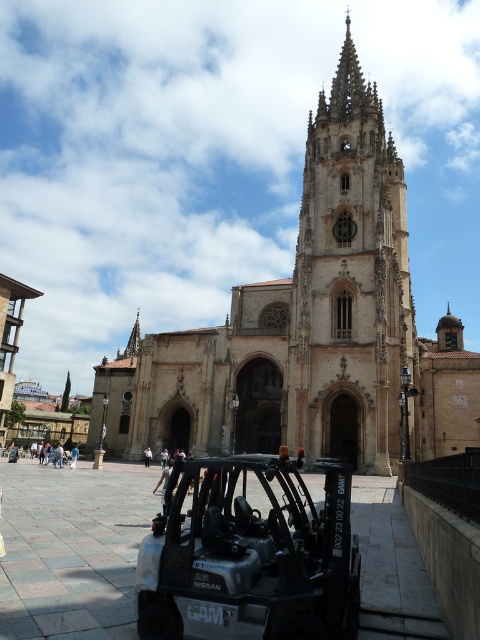
You are standing at the entrance of the beige stone church at center. If you look towards the direction of the forklift parked on the paved area in the foreground, which direction should you face?

The beige stone church at center is located at point (308, 328), which is the center of the image. The forklift is in the foreground, so it is closer to the viewer. To face the direction of the forklift parked on the paved area in the foreground from the entrance of the beige stone church at center, you should face towards the foreground, which is typically the front part of the image. However, without specific spatial coordinates for the forklift, the exact direction cannot be determined beyond knowing.

You are standing in front of the beige stone church at center and the golden stone tower at center. Which structure is closer to you?

The beige stone church at center is closer to you because it is in front of the golden stone tower at center.